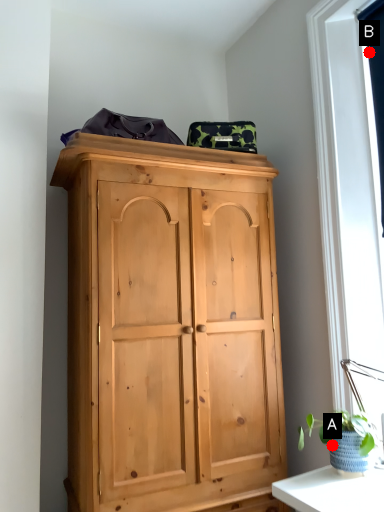
Question: Two points are circled on the image, labeled by A and B beside each circle. Which point is further to the camera?

Choices:
 (A) A is further
 (B) B is further

Answer: (B)